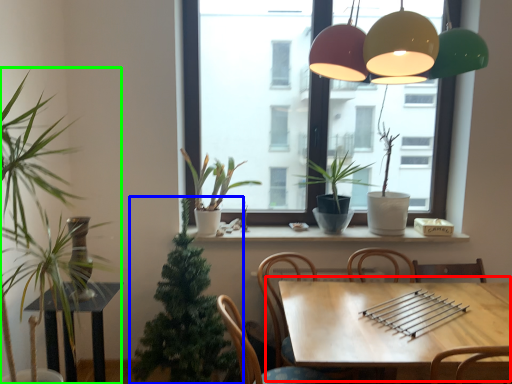
Question: Which object is positioned farthest from table (highlighted by a red box)? Select from houseplant (highlighted by a blue box) and houseplant (highlighted by a green box).

Choices:
 (A) houseplant
 (B) houseplant

Answer: (B)